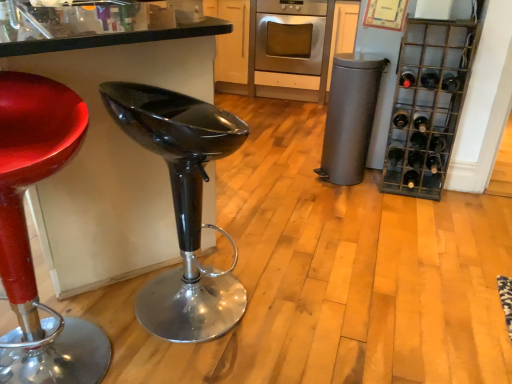
This screenshot has height=384, width=512. I want to click on unoccupied region to the right of glossy black stool at left, so click(x=273, y=240).